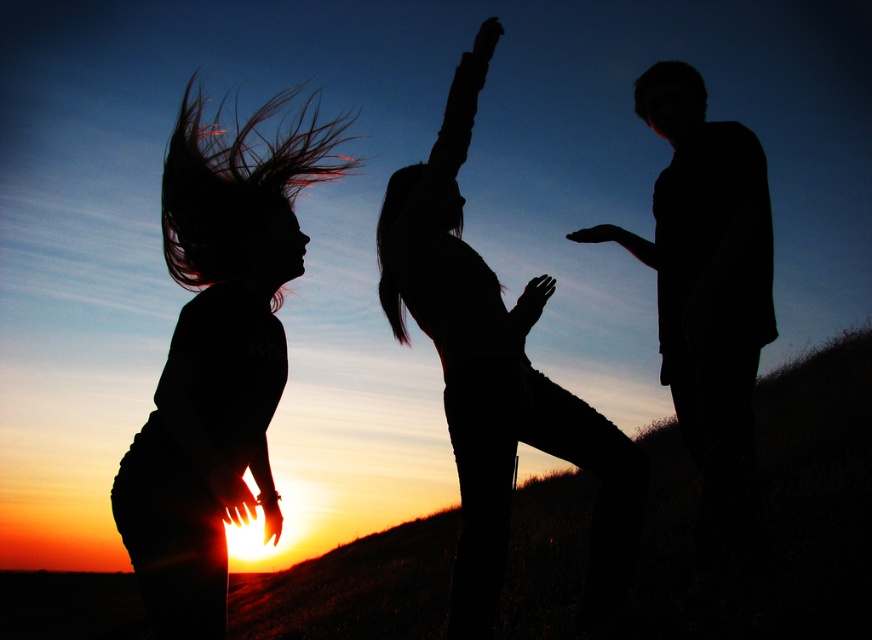
Does black matte hair at left have a larger size compared to silhouette yoga pose at center?

Incorrect, black matte hair at left is not larger than silhouette yoga pose at center.

Where is `black matte hair at left`? The image size is (872, 640). black matte hair at left is located at coordinates 216,358.

Is point (230, 292) closer to viewer compared to point (475, 609)?

That is True.

At what (x,y) coordinates should I click in order to perform the action: click on black matte hair at left. Please return your answer as a coordinate pair (x, y). The width and height of the screenshot is (872, 640). Looking at the image, I should click on (216, 358).

Can you confirm if silhouette yoga pose at center is shorter than silhouette man at right?

In fact, silhouette yoga pose at center may be taller than silhouette man at right.

Between silhouette yoga pose at center and silhouette man at right, which one has more height?

Standing taller between the two is silhouette yoga pose at center.

Who is more distant from viewer, (632, 470) or (644, 244)?

The point (644, 244) is behind.

Where is `silhouette yoga pose at center`? This screenshot has height=640, width=872. silhouette yoga pose at center is located at coordinates point(496,378).

Who is positioned more to the right, black matte hair at left or silhouette man at right?

silhouette man at right

Is point (162, 404) in front of point (737, 218)?

Yes, it is.

Where is `black matte hair at left`? Image resolution: width=872 pixels, height=640 pixels. black matte hair at left is located at coordinates (216, 358).